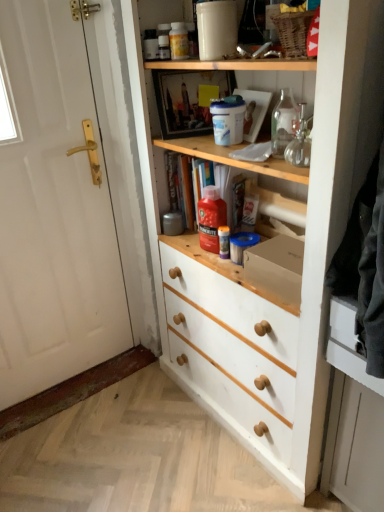
Question: Choose the correct answer: Is white painted wood cupboard at center inside white matte drawer at lower right or outside it?

Choices:
 (A) inside
 (B) outside

Answer: (B)

Question: From the image's perspective, is white painted wood cupboard at center above or below white matte drawer at lower right?

Choices:
 (A) below
 (B) above

Answer: (B)

Question: Which object is positioned closest to the red plastic bottle at center, which is the 1th bottle from bottom to top?

Choices:
 (A) translucent plastic bottle at upper center, which is counted as the 2th bottle, starting from the right
 (B) transparent glass bottle at upper right
 (C) white painted wood cupboard at center
 (D) white matte door at left
 (E) white matte drawer at lower right

Answer: (C)

Question: Estimate the real-world distances between objects in this image. Which object is farther from the transparent glass bottle at upper right?

Choices:
 (A) white matte door at left
 (B) translucent plastic bottle at upper center, which is the 1th bottle from left to right
 (C) white painted wood cupboard at center
 (D) red plastic bottle at center, marked as the second bottle in a top-to-bottom arrangement
 (E) white matte drawer at lower right

Answer: (A)